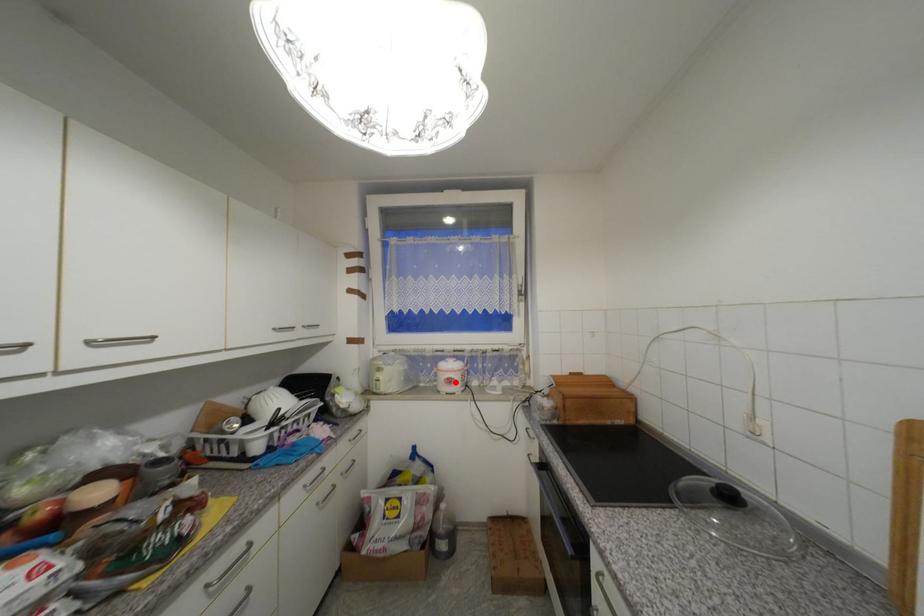
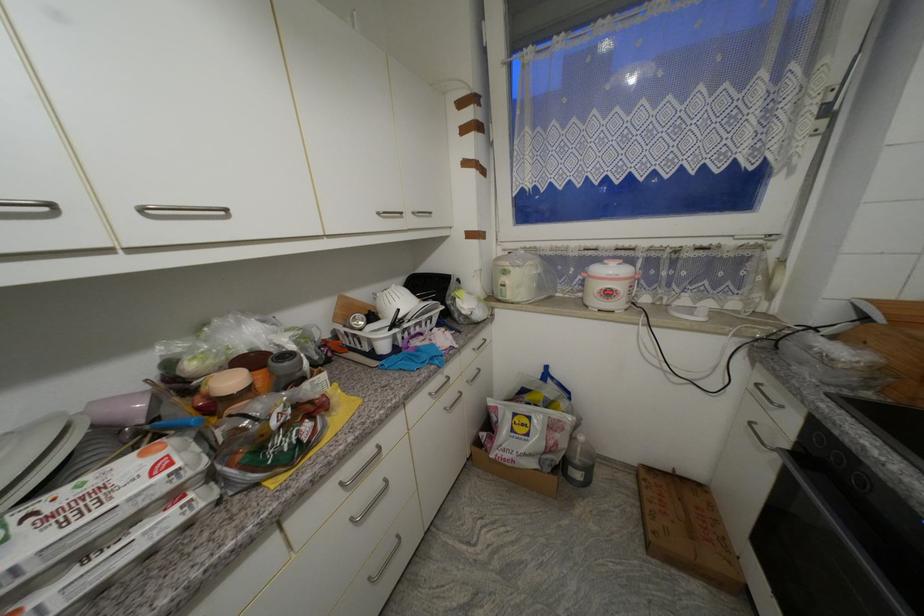
The point at the highlighted location is marked in the first image. Where is the corresponding point in the second image?

(614, 294)